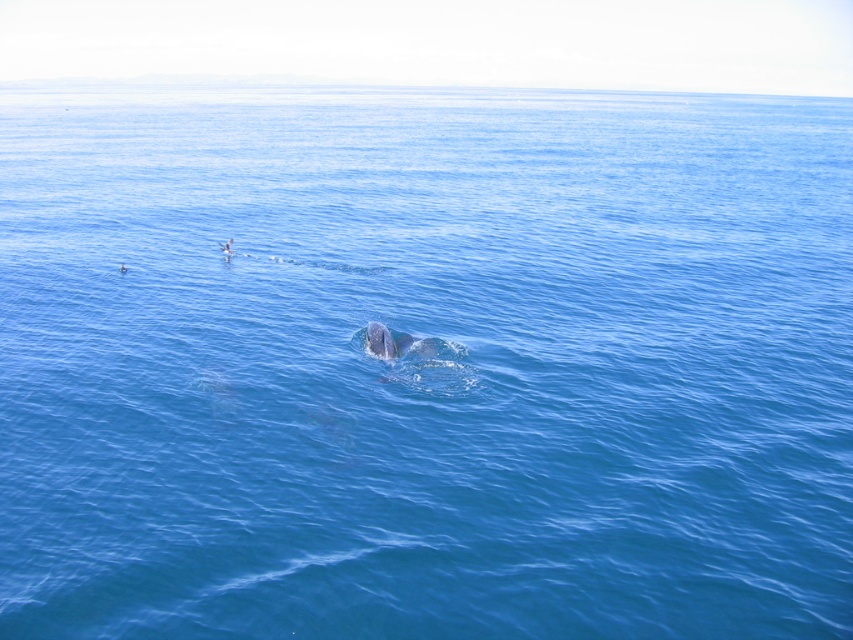
Question: Which point is farther from the camera taking this photo?

Choices:
 (A) (383, 356)
 (B) (224, 243)

Answer: (B)

Question: Can you confirm if gray matte whale at center is smaller than smooth skin person at upper left?

Choices:
 (A) no
 (B) yes

Answer: (A)

Question: Is gray matte whale at center smaller than smooth skin person at upper left?

Choices:
 (A) no
 (B) yes

Answer: (A)

Question: Can you confirm if gray matte whale at center is positioned to the left of smooth skin person at upper left?

Choices:
 (A) no
 (B) yes

Answer: (A)

Question: Which object is farther from the camera taking this photo?

Choices:
 (A) smooth skin person at upper left
 (B) gray matte whale at center

Answer: (A)

Question: Which point is farther to the camera?

Choices:
 (A) smooth skin person at upper left
 (B) gray matte whale at center

Answer: (A)